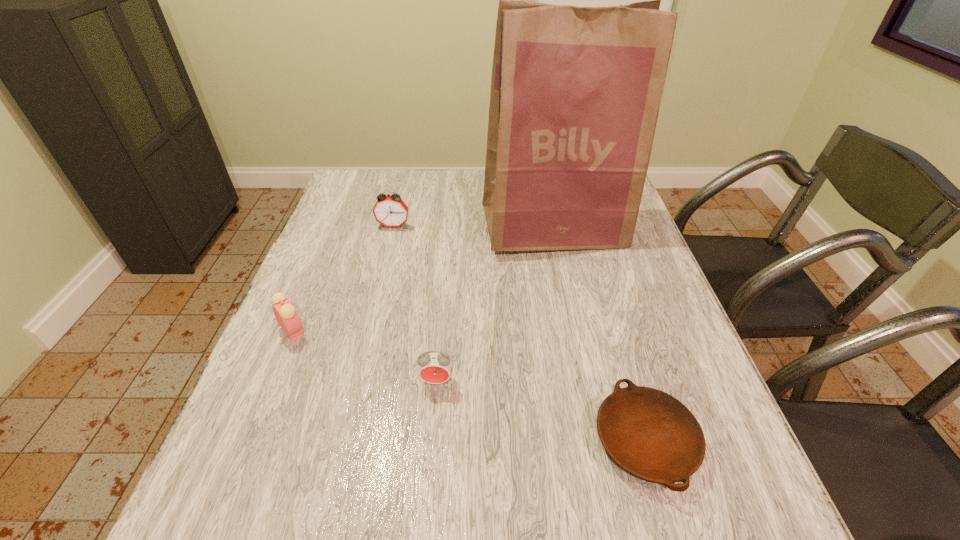
You are a GUI agent. You are given a task and a screenshot of the screen. Output one action in this format:
    pyautogui.click(x=<x>, y=<y>)
    Task: Click on the vacant region between the tallest object and the second farthest alarm clock
    This screenshot has height=540, width=960.
    Given the screenshot: What is the action you would take?
    pyautogui.click(x=423, y=280)

Where is `free point between the grocery bag and the plate`? free point between the grocery bag and the plate is located at coordinates (600, 335).

Find the location of a particular element. The height and width of the screenshot is (540, 960). free space between the second nearest object and the second farthest alarm clock is located at coordinates (365, 356).

This screenshot has height=540, width=960. I want to click on free space between the tallest alarm clock and the tallest object, so click(474, 228).

Find the location of `vacant point located between the fourth object from right to left and the leftmost object`. vacant point located between the fourth object from right to left and the leftmost object is located at coordinates (344, 279).

Choose which object is the fourth nearest neighbor to the plate. Please provide its 2D coordinates. Your answer should be formatted as a tuple, i.e. [(x, y)], where the tuple contains the x and y coordinates of a point satisfying the conditions above.

[(390, 211)]

Choose which object is the third nearest neighbor to the fourth shortest object. Please provide its 2D coordinates. Your answer should be formatted as a tuple, i.e. [(x, y)], where the tuple contains the x and y coordinates of a point satisfying the conditions above.

[(434, 367)]

Point out which alarm clock is positioned as the nearest to the grocery bag. Please provide its 2D coordinates. Your answer should be formatted as a tuple, i.e. [(x, y)], where the tuple contains the x and y coordinates of a point satisfying the conditions above.

[(390, 211)]

Point out which alarm clock is positioned as the third nearest to the plate. Please provide its 2D coordinates. Your answer should be formatted as a tuple, i.e. [(x, y)], where the tuple contains the x and y coordinates of a point satisfying the conditions above.

[(390, 211)]

What are the coordinates of `free space that satisfies the following two spatial constraints: 1. on the face of the plate; 2. on the right side of the rightmost alarm clock` in the screenshot? It's located at (431, 441).